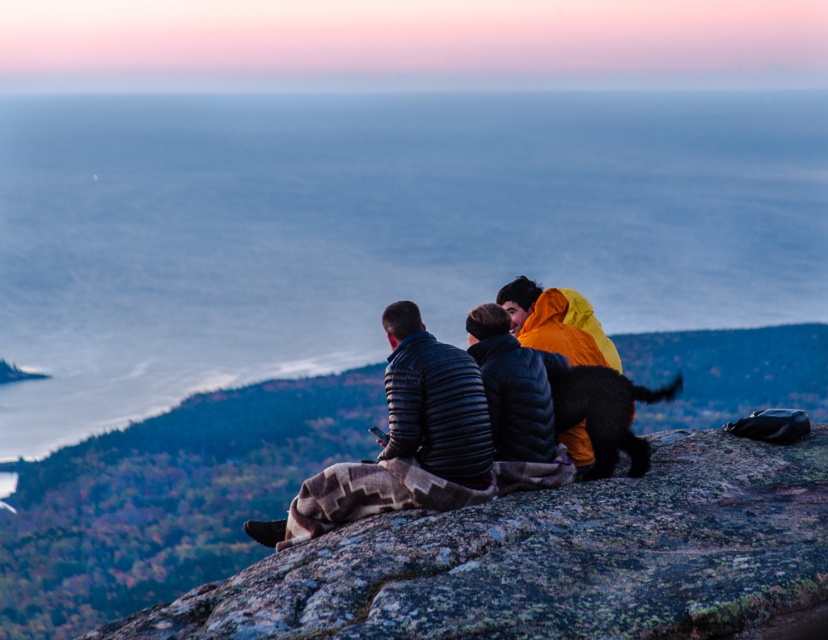
Based on the photo, you are a photographer trying to capture a group photo of the dark blue quilted jacket at center and the matte black jackets at center. If you want to ensure both subjects are fully visible in the frame, which jacket should you position closer to the camera?

The dark blue quilted jacket at center is narrower than the matte black jackets at center, so positioning the darker blue quilted jacket at center closer to the camera would allow both subjects to fit within the frame while ensuring visibility.

You are a photographer trying to capture the perfect shot of the rough textured rock at center. You need to position your camera exactly at the coordinates provided in the scene description. What are the coordinates where you should place your camera to best frame the rock?

The rough textured rock at center is located at coordinates (552, 560). To best frame the rock, position your camera at these coordinates.